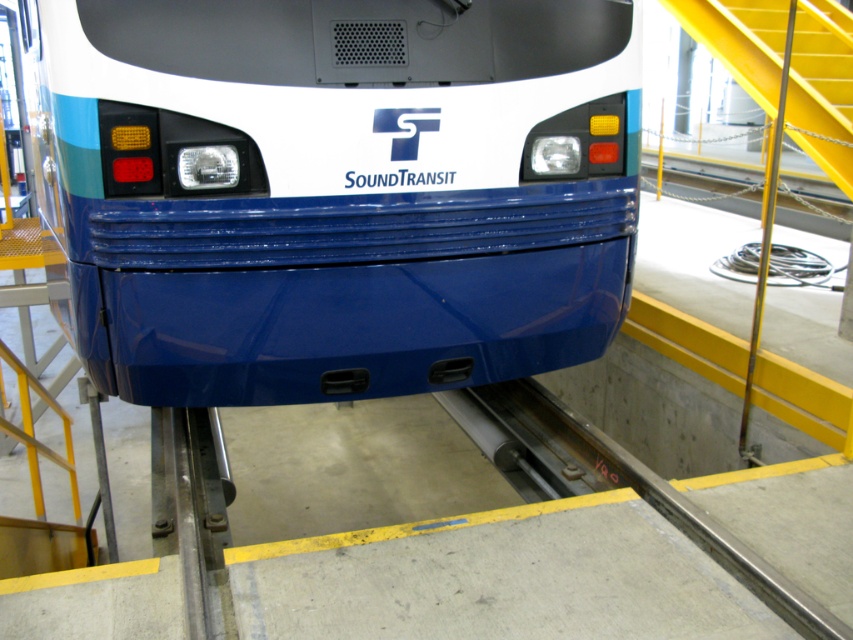
Question: Is glossy blue train at center wider than yellow metal stairs at upper right?

Choices:
 (A) yes
 (B) no

Answer: (A)

Question: Can you confirm if glossy blue train at center is positioned below yellow metal stairs at upper right?

Choices:
 (A) yes
 (B) no

Answer: (A)

Question: Is glossy blue train at center closer to camera compared to yellow metal stairs at upper right?

Choices:
 (A) yes
 (B) no

Answer: (A)

Question: Among these objects, which one is farthest from the camera?

Choices:
 (A) yellow metal stairs at upper right
 (B) glossy blue train at center

Answer: (A)